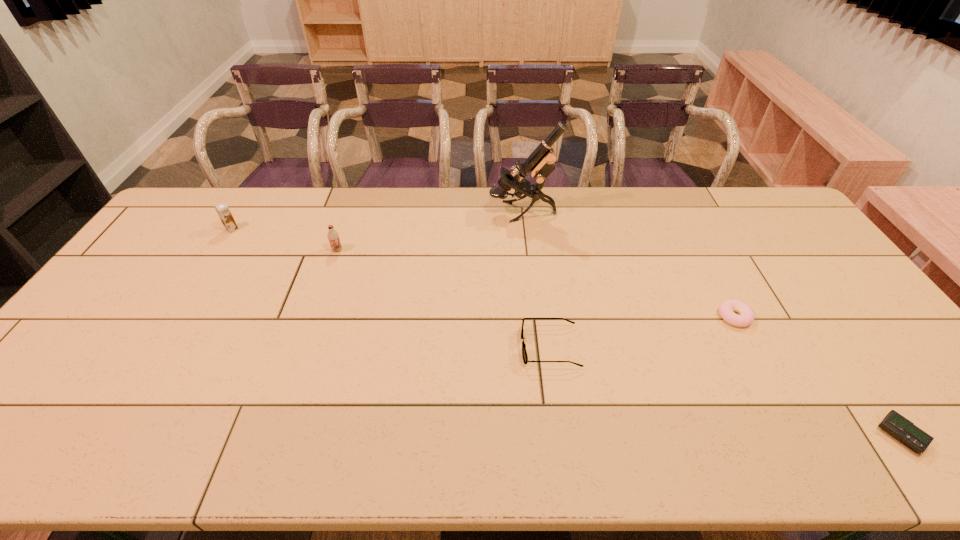
Locate an element on the screen. The height and width of the screenshot is (540, 960). the tallest object is located at coordinates (540, 162).

What are the coordinates of `microscope` in the screenshot? It's located at (540, 162).

Locate an element on the screen. This screenshot has height=540, width=960. the farther chocolate milk is located at coordinates (222, 209).

Where is `the leftmost object`? This screenshot has width=960, height=540. the leftmost object is located at coordinates (222, 209).

Where is `the fifth object from right to left`? The width and height of the screenshot is (960, 540). the fifth object from right to left is located at coordinates (333, 236).

This screenshot has height=540, width=960. What are the coordinates of `the nearer chocolate milk` in the screenshot? It's located at (333, 236).

Locate an element on the screen. The height and width of the screenshot is (540, 960). spectacles is located at coordinates (524, 353).

Where is `doughnut`? Image resolution: width=960 pixels, height=540 pixels. doughnut is located at coordinates click(x=726, y=308).

This screenshot has height=540, width=960. I want to click on the second object from right to left, so click(x=726, y=308).

Locate an element on the screen. This screenshot has width=960, height=540. the nearest object is located at coordinates (903, 430).